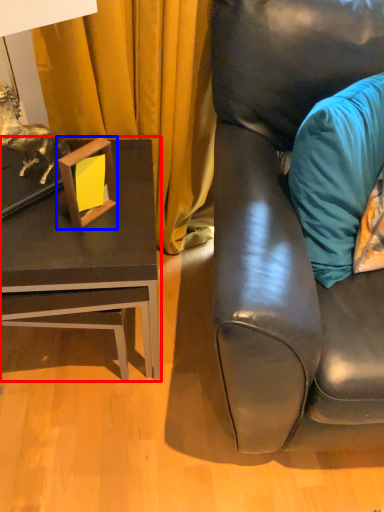
Question: Which point is further to the camera, table (highlighted by a red box) or picture frame (highlighted by a blue box)?

Choices:
 (A) table
 (B) picture frame

Answer: (A)